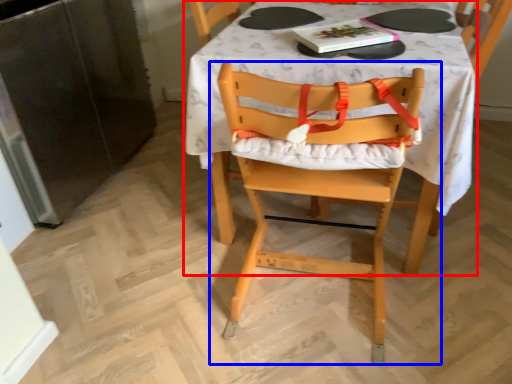
Question: Which of the following is the farthest to the observer, table (highlighted by a red box) or chair (highlighted by a blue box)?

Choices:
 (A) table
 (B) chair

Answer: (A)